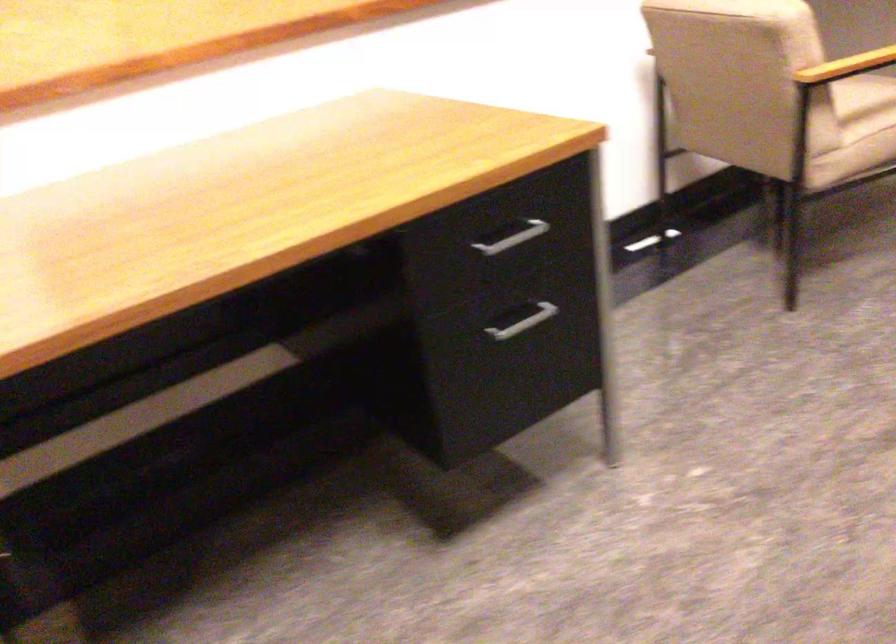
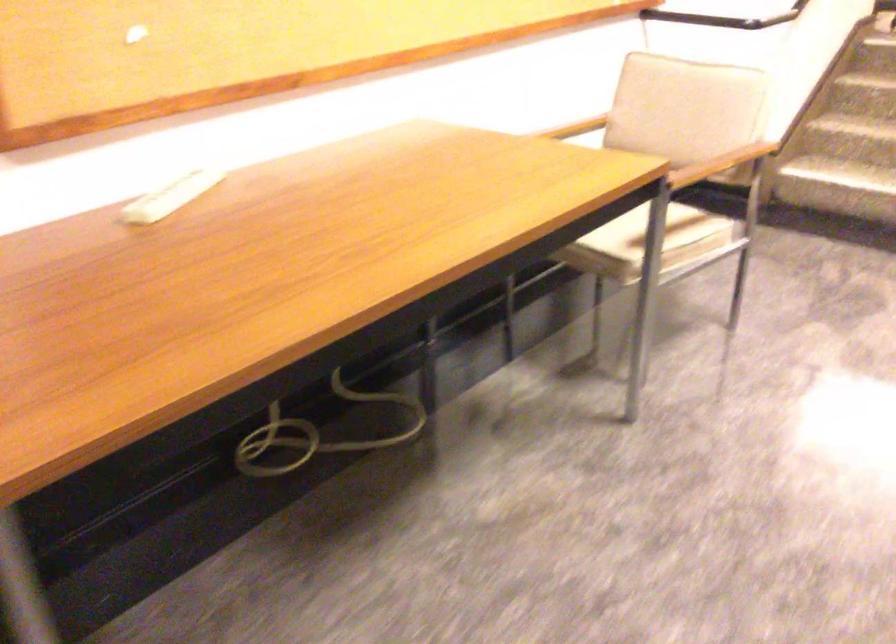
In a continuous first-person perspective shot, in which direction is the camera moving?

The cameraman walked toward right, forward.